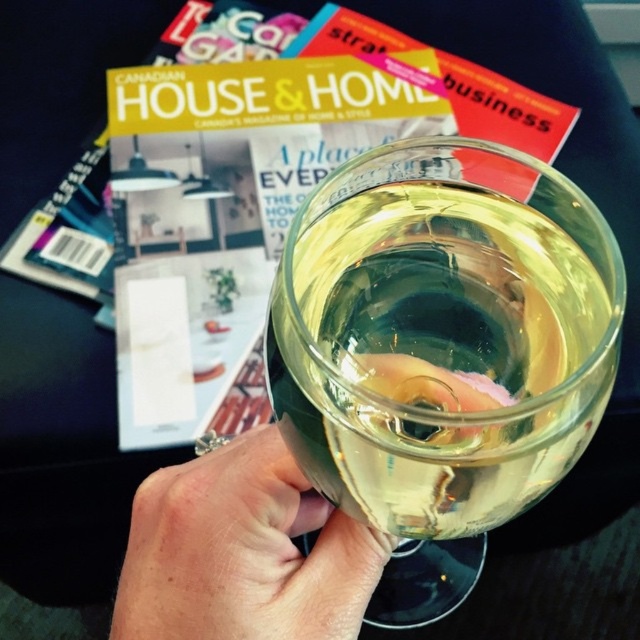
Question: Does transparent glass at center have a smaller size compared to matte paper magazine at upper center?

Choices:
 (A) yes
 (B) no

Answer: (A)

Question: Which of these objects is positioned farthest from the transparent glass at center?

Choices:
 (A) matte paper magazine at upper center
 (B) translucent glass at center

Answer: (A)

Question: Estimate the real-world distances between objects in this image. Which object is farther from the transparent glass at center?

Choices:
 (A) translucent glass at center
 (B) matte paper magazine at upper center

Answer: (B)

Question: Which of the following is the farthest from the observer?

Choices:
 (A) (292, 451)
 (B) (300, 22)

Answer: (B)

Question: Is transparent glass at center to the left of matte paper magazine at upper center from the viewer's perspective?

Choices:
 (A) no
 (B) yes

Answer: (A)

Question: Does transparent glass at center have a greater width compared to matte paper magazine at upper center?

Choices:
 (A) yes
 (B) no

Answer: (B)